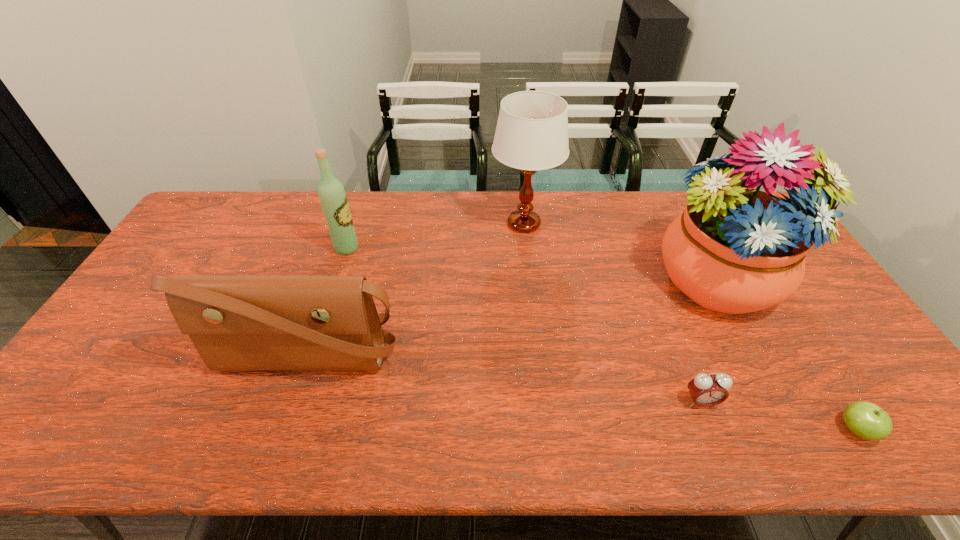
You are a GUI agent. You are given a task and a screenshot of the screen. Output one action in this format:
    pyautogui.click(x=<x>, y=<y>)
    Task: Click on the vacant area at the near edge of the desktop
    
    Given the screenshot: What is the action you would take?
    pyautogui.click(x=205, y=437)

In order to click on vacant space at the left edge of the desktop in this screenshot , I will do `click(202, 270)`.

The image size is (960, 540). I want to click on free space at the right edge of the desktop, so click(x=859, y=377).

Identify the location of vacant area that lies between the satchel and the apple. (581, 393).

The image size is (960, 540). What are the coordinates of `free spot between the fifth tallest object and the nearest object` in the screenshot? It's located at (779, 416).

Identify the location of vacant area that lies between the second shortest object and the flower arrangement. (710, 342).

Find the location of `vacant region between the nearest object and the table lamp`. vacant region between the nearest object and the table lamp is located at coordinates (690, 327).

Find the location of a particular element. The width and height of the screenshot is (960, 540). free point between the satchel and the second nearest object is located at coordinates (503, 379).

Where is `free space between the fourth object from right to left and the shortest object`? free space between the fourth object from right to left and the shortest object is located at coordinates (690, 327).

Identify the location of free spot between the table lamp and the nearest object. 690,327.